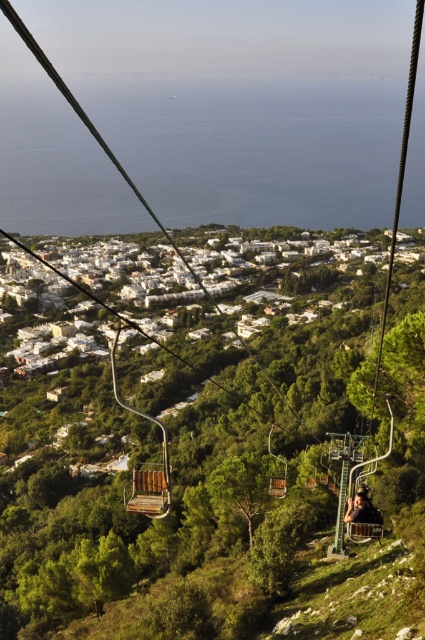
Question: Is the position of smooth brown hair at lower right less distant than that of wooden bench at center?

Choices:
 (A) yes
 (B) no

Answer: (A)

Question: Which of the following is the farthest from the observer?

Choices:
 (A) wooden bench at center
 (B) smooth brown hair at lower right

Answer: (A)

Question: Among these objects, which one is nearest to the camera?

Choices:
 (A) smooth brown hair at lower right
 (B) wooden bench at center

Answer: (A)

Question: Is smooth brown hair at lower right smaller than wooden bench at center?

Choices:
 (A) no
 (B) yes

Answer: (A)

Question: Is smooth brown hair at lower right above wooden bench at center?

Choices:
 (A) no
 (B) yes

Answer: (B)